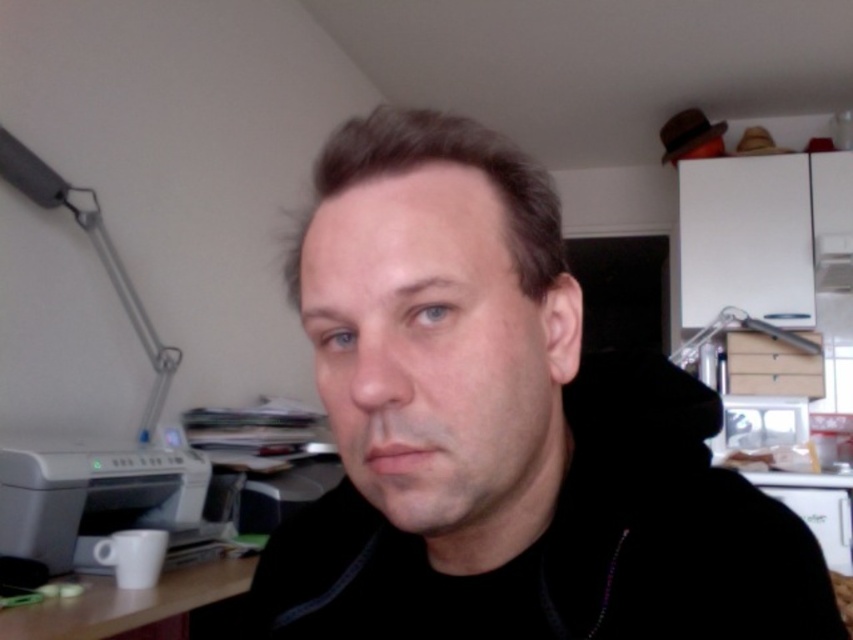
Question: Does black matte jacket at center have a larger size compared to matte gray lamp at upper left?

Choices:
 (A) yes
 (B) no

Answer: (B)

Question: Which object is closer to the camera taking this photo?

Choices:
 (A) white plastic printer at lower left
 (B) matte gray lamp at upper left

Answer: (A)

Question: Which of these objects is positioned farthest from the white matte table at lower left?

Choices:
 (A) white plastic printer at lower left
 (B) matte gray lamp at upper left
 (C) black matte jacket at center

Answer: (C)

Question: Considering the relative positions of white plastic printer at lower left and white matte table at lower left in the image provided, where is white plastic printer at lower left located with respect to white matte table at lower left?

Choices:
 (A) below
 (B) above

Answer: (B)

Question: From the image, what is the correct spatial relationship of black matte jacket at center in relation to white matte table at lower left?

Choices:
 (A) below
 (B) above

Answer: (B)

Question: Which object is closer to the camera taking this photo?

Choices:
 (A) white matte table at lower left
 (B) white plastic printer at lower left
 (C) matte gray lamp at upper left
 (D) black matte jacket at center

Answer: (D)